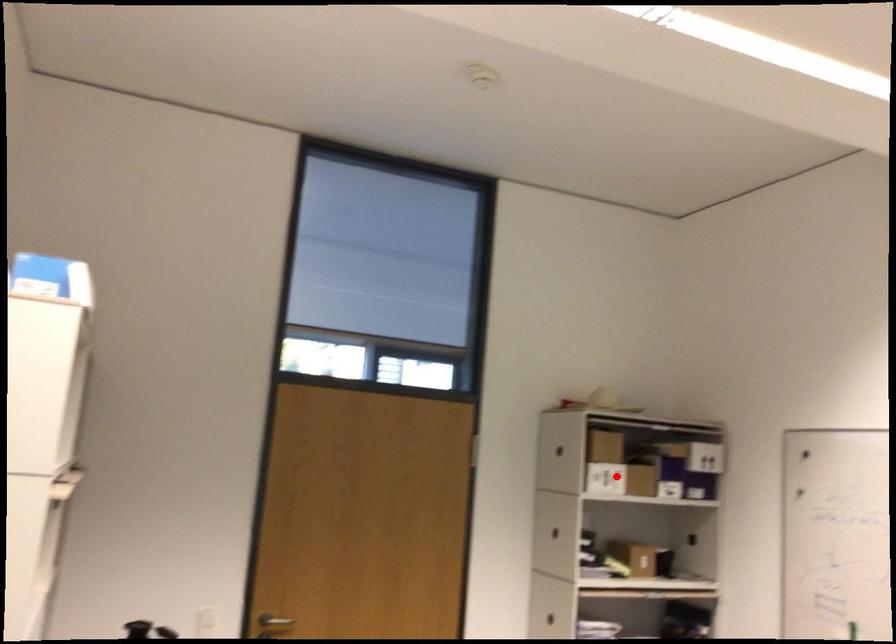
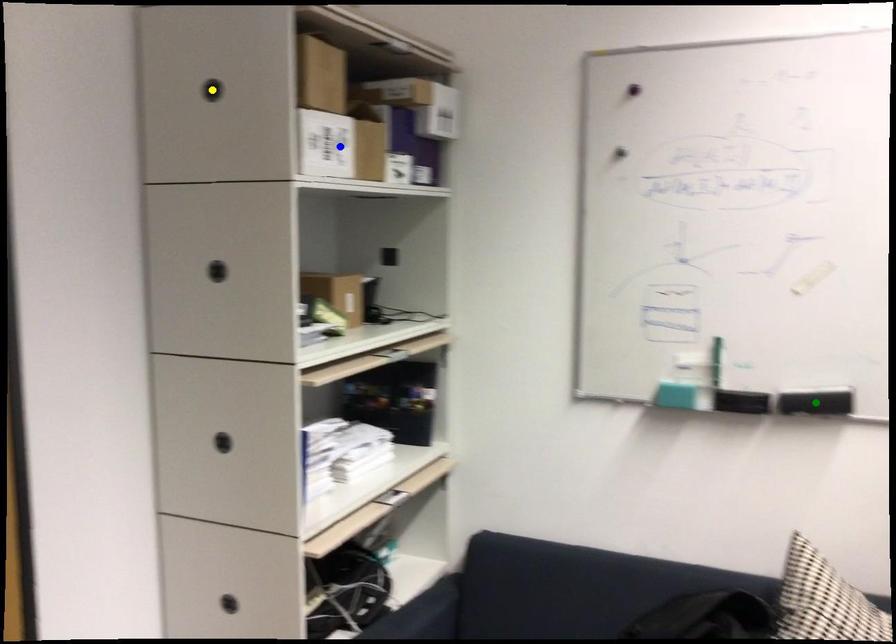
Question: I am providing you with two images of the same scene from different viewpoints. A red point is marked on the first image. You are given multiple points on the second image. Can you choose the point in image 2 that corresponds to the point in image 1?

Choices:
 (A) blue point
 (B) yellow point
 (C) green point

Answer: (A)